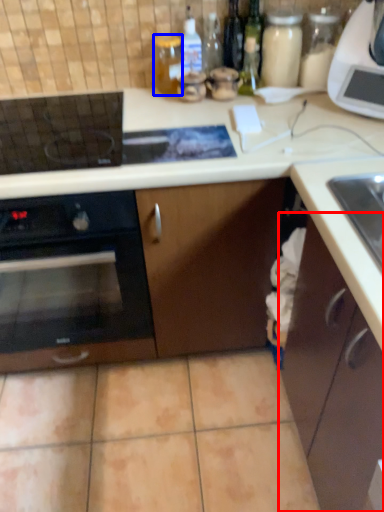
Question: Which object is closer to the camera taking this photo, cabinetry (highlighted by a red box) or bottle (highlighted by a blue box)?

Choices:
 (A) cabinetry
 (B) bottle

Answer: (A)